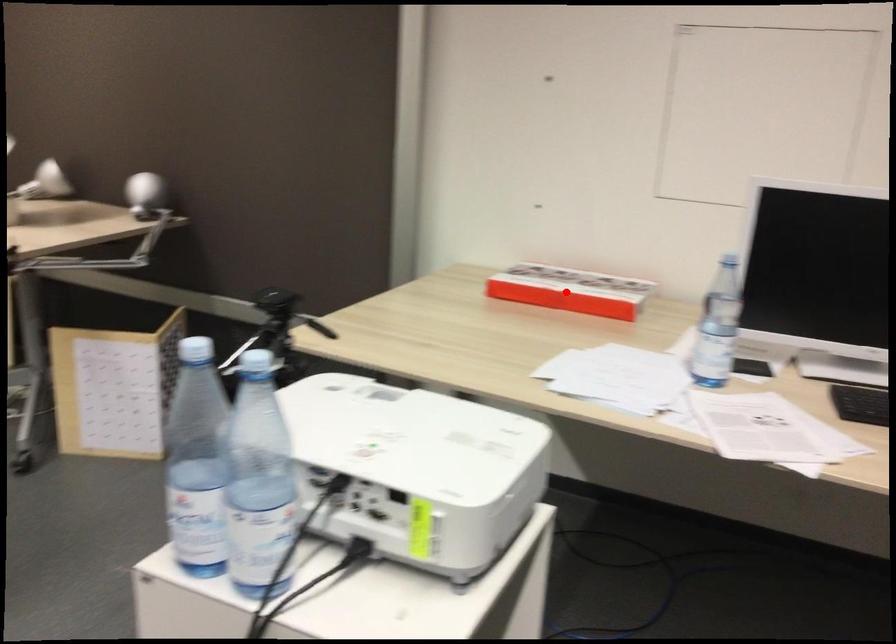
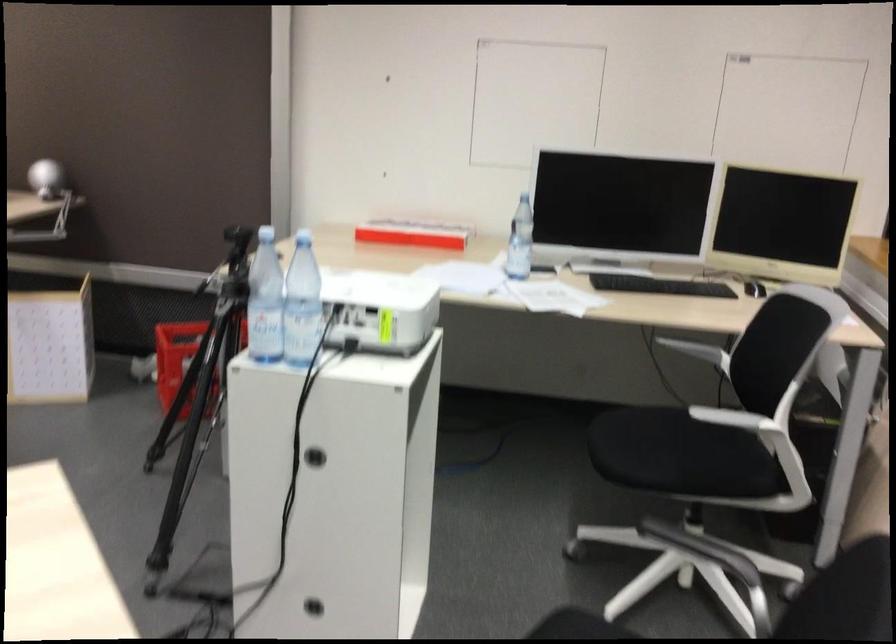
Question: I am providing you with two images of the same scene from different viewpoints. Given a red point in image1, look at the same physical point in image2. Is it:

Choices:
 (A) Closer to the viewpoint
 (B) Farther from the viewpoint

Answer: (B)